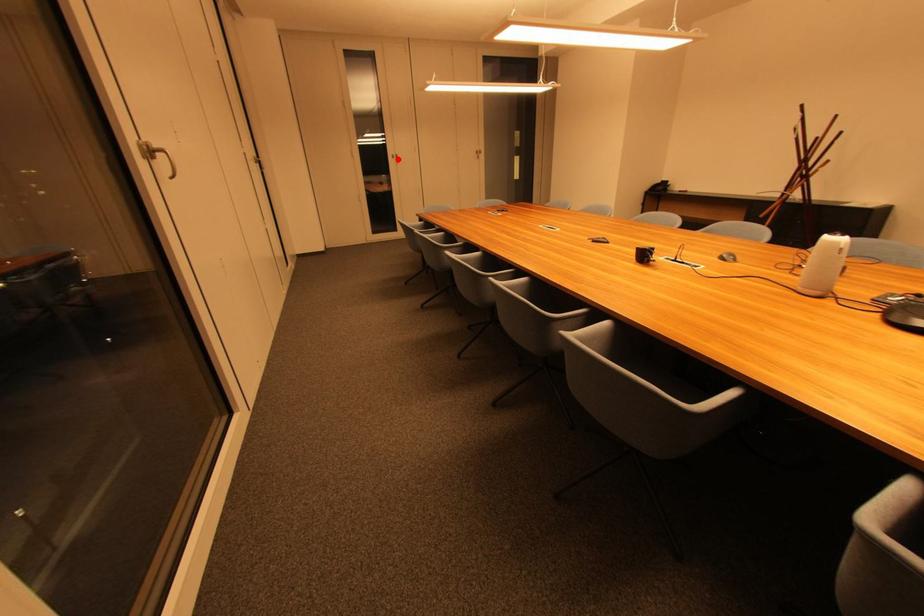
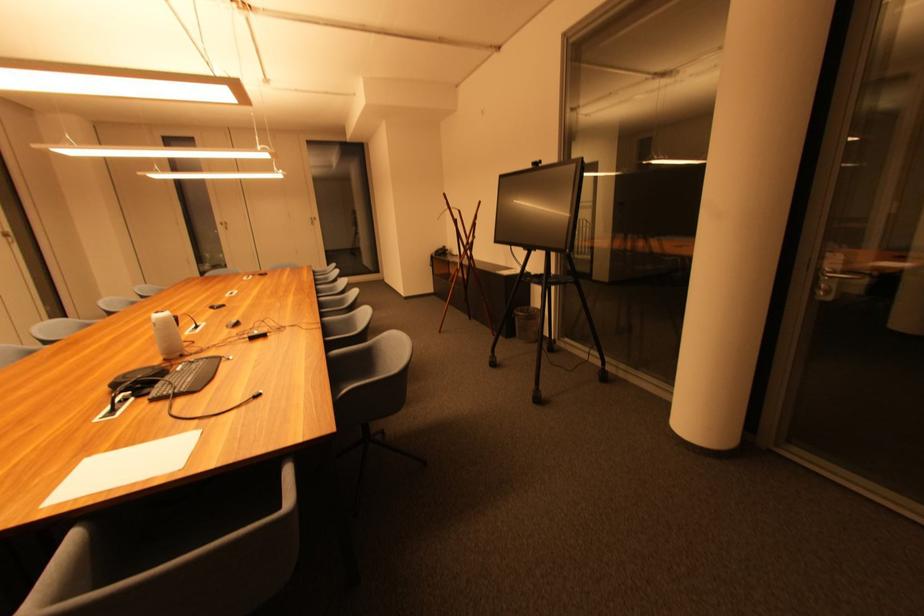
Question: I am providing you with two images of the same scene from different viewpoints. A red point is shown in image1. For the corresponding object point in image2, is it positioned nearer or farther from the camera?

Choices:
 (A) Nearer
 (B) Farther

Answer: (B)